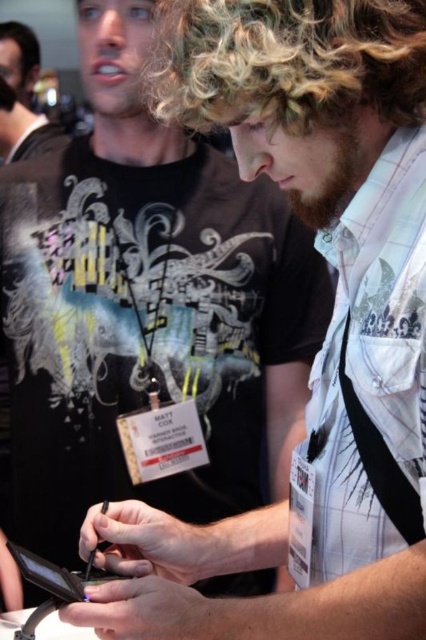
Question: Which object appears farthest from the camera in this image?

Choices:
 (A) black matte smartphone at lower left
 (B) curly blonde hair at center

Answer: (A)

Question: Is matte black shirt at upper left positioned in front of black matte smartphone at lower left?

Choices:
 (A) no
 (B) yes

Answer: (A)

Question: Estimate the real-world distances between objects in this image. Which object is closer to the white textured shirt at center?

Choices:
 (A) dark brown curly hair at upper left
 (B) curly blonde hair at center
 (C) matte black shirt at upper left

Answer: (B)

Question: Does white textured shirt at center have a larger size compared to black matte smartphone at lower left?

Choices:
 (A) no
 (B) yes

Answer: (B)

Question: Does white textured shirt at center have a larger size compared to matte black shirt at upper left?

Choices:
 (A) no
 (B) yes

Answer: (B)

Question: Which object appears farthest from the camera in this image?

Choices:
 (A) matte black shirt at upper left
 (B) white textured shirt at center
 (C) dark brown curly hair at upper left

Answer: (C)